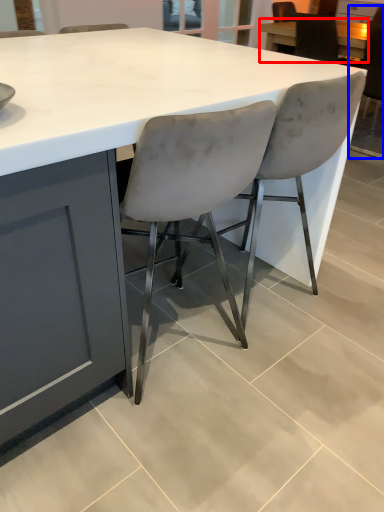
Question: Which object appears closest to the camera in this image, table (highlighted by a red box) or chair (highlighted by a blue box)?

Choices:
 (A) table
 (B) chair

Answer: (B)